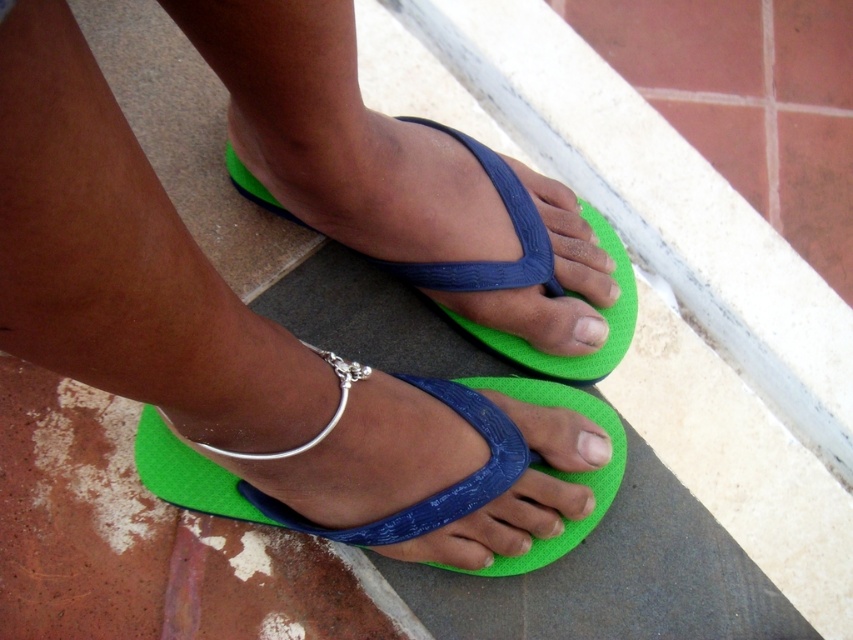
You are a foot model standing on the tiles. You need to show off your flip flops. Which toe is covering the other one? Specifically mention both the white matte toe at center and the matte blue toe at center in your answer.

The white matte toe at center is positioned under the matte blue toe at center, so the matte blue toe at center is covering the white matte toe at center.